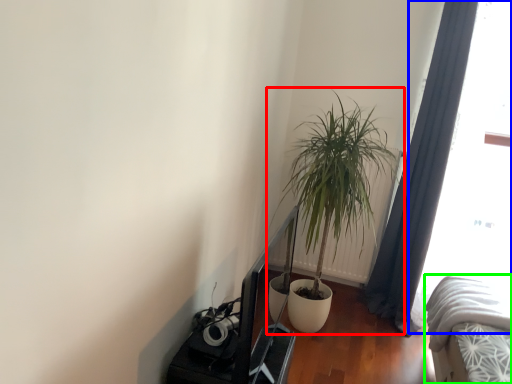
Question: Estimate the real-world distances between objects in this image. Which object is farther from houseplant (highlighted by a red box), window screen (highlighted by a blue box) or bed (highlighted by a green box)?

Choices:
 (A) window screen
 (B) bed

Answer: (B)